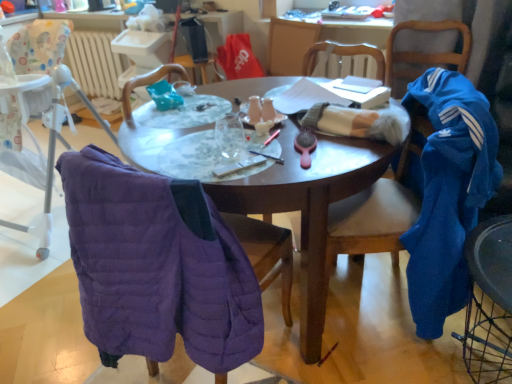
The width and height of the screenshot is (512, 384). I want to click on vacant area that is in front of matte black pen at center, so click(x=269, y=172).